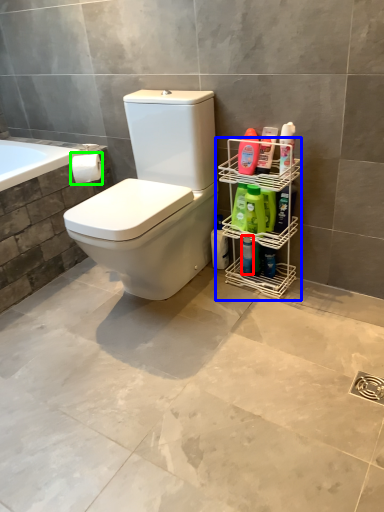
Question: Which is farther away from cleaning product (highlighted by a red box)? porcelain (highlighted by a blue box) or toilet paper (highlighted by a green box)?

Choices:
 (A) porcelain
 (B) toilet paper

Answer: (B)